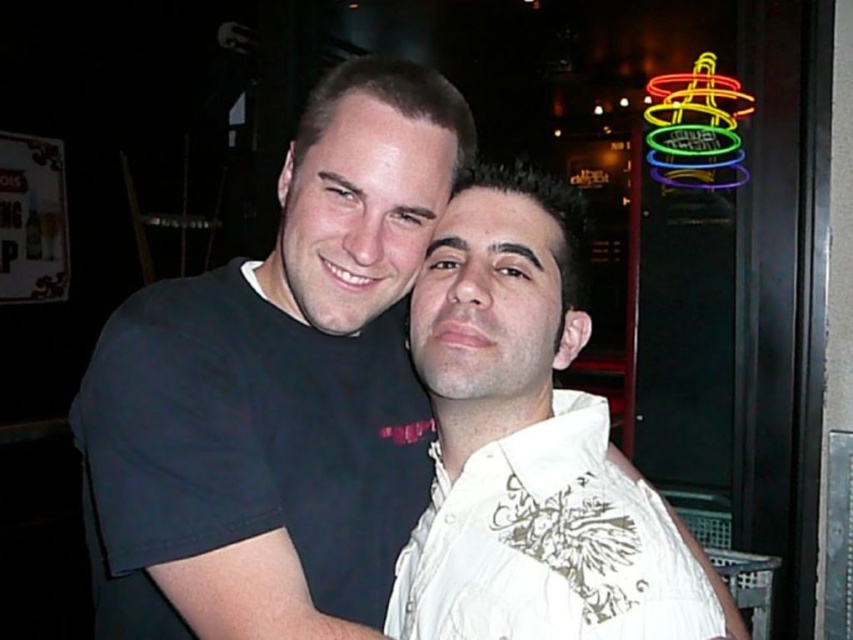
You are at a social event and want to take a photo of the neon sign at upper right without including the white embroidered shirt at center. Based on their positions, where should you position yourself relative to the subjects?

The white embroidered shirt at center is located below the neon sign at upper right, so positioning yourself above the subjects would allow you to capture the neon sign at upper right without including the white embroidered shirt at center.